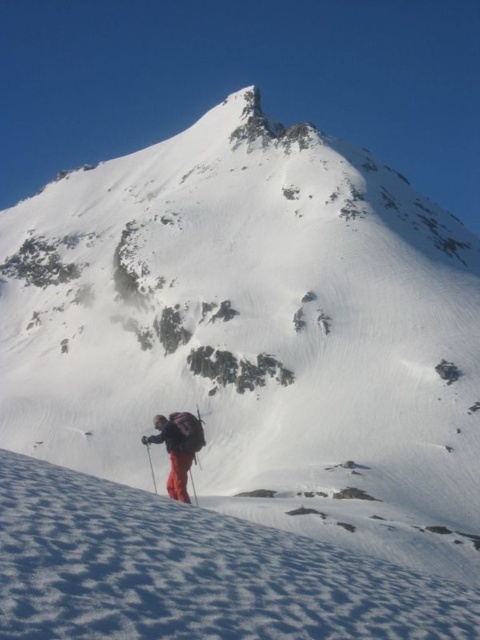
Question: Which object is positioned closest to the black plastic ski pole at lower center?

Choices:
 (A) white powdery snow at lower center
 (B) matte black ski pole at lower center

Answer: (B)

Question: Can you confirm if red fabric backpack at lower center is wider than black plastic ski pole at lower center?

Choices:
 (A) yes
 (B) no

Answer: (A)

Question: Which object is farther from the camera taking this photo?

Choices:
 (A) black plastic ski pole at lower center
 (B) matte black ski pole at lower center
 (C) white powdery snow at lower center
 (D) red fabric backpack at lower center

Answer: (B)

Question: Which object is closer to the camera taking this photo?

Choices:
 (A) black plastic ski pole at lower center
 (B) red fabric backpack at lower center
 (C) white powdery snow at lower center

Answer: (C)

Question: Does red fabric backpack at lower center lie in front of matte black ski pole at lower center?

Choices:
 (A) yes
 (B) no

Answer: (A)

Question: Does white powdery snow at lower center appear on the left side of red fabric backpack at lower center?

Choices:
 (A) yes
 (B) no

Answer: (B)